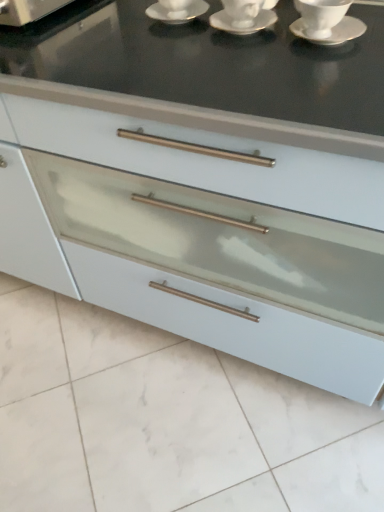
Question: Does white ceramic saucer at upper center, the 1th saucer from the left, appear on the left side of white ceramic cup at upper right?

Choices:
 (A) no
 (B) yes

Answer: (B)

Question: From the image's perspective, is white ceramic saucer at upper center, the 1th saucer from the left, on top of white ceramic cup at upper right?

Choices:
 (A) yes
 (B) no

Answer: (A)

Question: Is white ceramic cup at upper right inside white ceramic saucer at upper center, which is the third saucer from right to left?

Choices:
 (A) no
 (B) yes

Answer: (A)

Question: Can you confirm if white ceramic saucer at upper center, which is the third saucer from right to left, is taller than white ceramic cup at upper right?

Choices:
 (A) yes
 (B) no

Answer: (A)

Question: Considering the relative positions of white ceramic saucer at upper center, the 1th saucer from the left, and white ceramic cup at upper right in the image provided, is white ceramic saucer at upper center, the 1th saucer from the left, behind white ceramic cup at upper right?

Choices:
 (A) yes
 (B) no

Answer: (A)

Question: Does white ceramic saucer at upper center, which is the third saucer from right to left, have a greater width compared to white ceramic cup at upper right?

Choices:
 (A) no
 (B) yes

Answer: (B)

Question: Is white ceramic saucer at upper center, which is the third saucer from right to left, taller than white glossy saucer at upper right, which ranks as the first saucer in right-to-left order?

Choices:
 (A) no
 (B) yes

Answer: (B)

Question: From a real-world perspective, is white ceramic saucer at upper center, the 1th saucer from the left, on white glossy saucer at upper right, which ranks as the first saucer in right-to-left order?

Choices:
 (A) yes
 (B) no

Answer: (A)

Question: Does white ceramic saucer at upper center, the 1th saucer from the left, turn towards white glossy saucer at upper right, which ranks as the first saucer in right-to-left order?

Choices:
 (A) no
 (B) yes

Answer: (A)

Question: Would you say white ceramic saucer at upper center, the 1th saucer from the left, is outside white glossy saucer at upper right, which ranks as the first saucer in right-to-left order?

Choices:
 (A) yes
 (B) no

Answer: (A)

Question: Is white ceramic saucer at upper center, which is the third saucer from right to left, behind white glossy saucer at upper right, which ranks as the first saucer in right-to-left order?

Choices:
 (A) yes
 (B) no

Answer: (A)

Question: From a real-world perspective, is white ceramic saucer at upper center, which is the third saucer from right to left, beneath white glossy saucer at upper right, the third saucer from the left?

Choices:
 (A) yes
 (B) no

Answer: (B)

Question: Does white ceramic cup at upper right have a greater width compared to white glossy saucer at upper right, which ranks as the first saucer in right-to-left order?

Choices:
 (A) no
 (B) yes

Answer: (A)